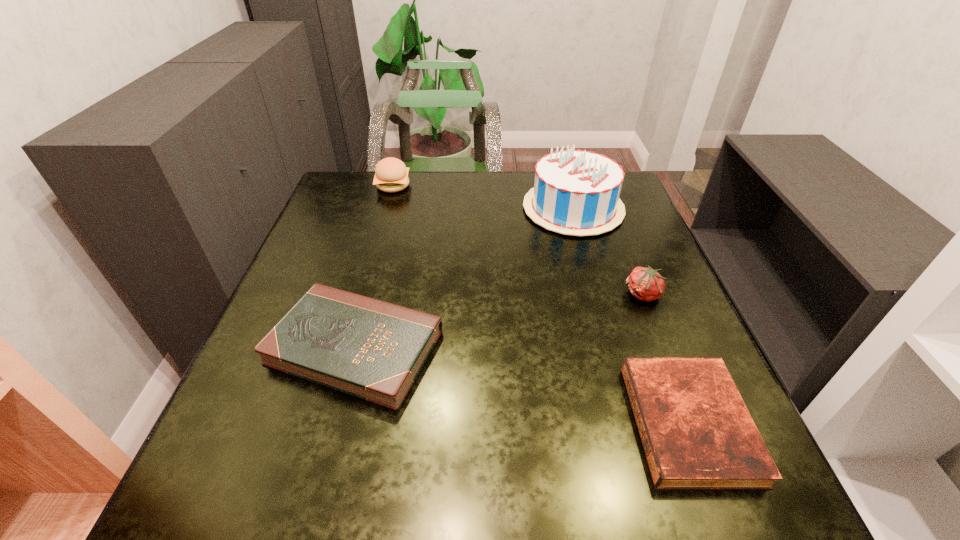
This screenshot has width=960, height=540. I want to click on tomato situated at the right edge, so click(646, 284).

Where is `Bible that is at the right edge`? The height and width of the screenshot is (540, 960). Bible that is at the right edge is located at coordinates (697, 433).

Where is `object that is positioned at the far left corner`? object that is positioned at the far left corner is located at coordinates (391, 175).

Find the location of a particular element. The height and width of the screenshot is (540, 960). object positioned at the far right corner is located at coordinates (576, 192).

This screenshot has height=540, width=960. What are the coordinates of `object that is at the near right corner` in the screenshot? It's located at (697, 433).

Where is `blank space at the far edge`? blank space at the far edge is located at coordinates (426, 184).

This screenshot has width=960, height=540. In order to click on free space at the near edge of the desktop in this screenshot , I will do `click(551, 498)`.

Image resolution: width=960 pixels, height=540 pixels. Find the location of `free space at the left edge of the desktop`. free space at the left edge of the desktop is located at coordinates (348, 266).

The image size is (960, 540). In the image, there is a desktop. What are the coordinates of `free space at the right edge` in the screenshot? It's located at (661, 353).

Image resolution: width=960 pixels, height=540 pixels. I want to click on vacant area at the far left corner, so click(x=364, y=205).